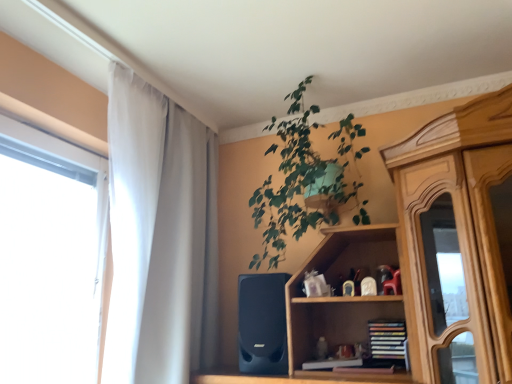
Question: Is green leafy plant at upper center not near white sheer curtain at left?

Choices:
 (A) yes
 (B) no

Answer: (B)

Question: Is green leafy plant at upper center facing towards white sheer curtain at left?

Choices:
 (A) no
 (B) yes

Answer: (A)

Question: Can we say green leafy plant at upper center lies outside white sheer curtain at left?

Choices:
 (A) yes
 (B) no

Answer: (A)

Question: Is green leafy plant at upper center looking in the opposite direction of white sheer curtain at left?

Choices:
 (A) yes
 (B) no

Answer: (B)

Question: Is green leafy plant at upper center at the right side of white sheer curtain at left?

Choices:
 (A) yes
 (B) no

Answer: (A)

Question: Would you say white sheer curtain at left is part of green leafy plant at upper center's contents?

Choices:
 (A) yes
 (B) no

Answer: (B)

Question: Considering the relative sizes of white sheer curtain at left and hardcover books at center in the image provided, is white sheer curtain at left wider than hardcover books at center?

Choices:
 (A) yes
 (B) no

Answer: (A)

Question: From a real-world perspective, is white sheer curtain at left under hardcover books at center?

Choices:
 (A) yes
 (B) no

Answer: (B)

Question: From a real-world perspective, is white sheer curtain at left over hardcover books at center?

Choices:
 (A) no
 (B) yes

Answer: (B)

Question: Can you confirm if white sheer curtain at left is taller than hardcover books at center?

Choices:
 (A) yes
 (B) no

Answer: (A)

Question: Can you confirm if white sheer curtain at left is positioned to the left of hardcover books at center?

Choices:
 (A) no
 (B) yes

Answer: (B)

Question: Does white sheer curtain at left lie in front of hardcover books at center?

Choices:
 (A) yes
 (B) no

Answer: (A)

Question: From the image's perspective, is hardcover books at center beneath green leafy plant at upper center?

Choices:
 (A) no
 (B) yes

Answer: (B)